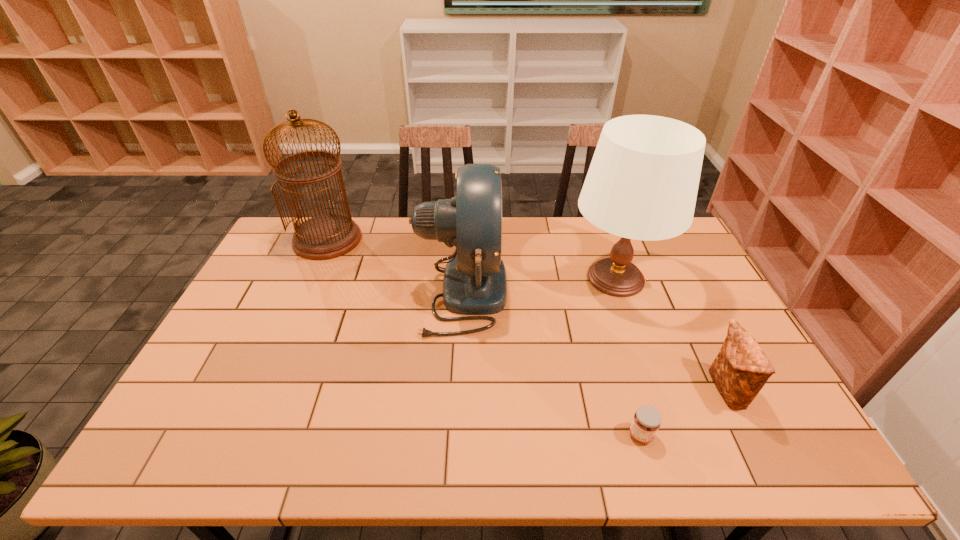
Find the location of a particular element. The height and width of the screenshot is (540, 960). lamp that is at the right edge is located at coordinates pos(642,183).

This screenshot has width=960, height=540. Find the location of `clutch bag at the right edge`. clutch bag at the right edge is located at coordinates (741, 369).

I want to click on object situated at the far left corner, so click(327, 236).

Identify the location of object that is at the far right corner. (642, 183).

Identify the location of vacant space at the far edge of the desktop. Image resolution: width=960 pixels, height=540 pixels. (508, 238).

Locate an element on the screen. This screenshot has height=540, width=960. free space at the near edge of the desktop is located at coordinates (601, 435).

This screenshot has height=540, width=960. In the image, there is a desktop. What are the coordinates of `vacant space at the left edge` in the screenshot? It's located at (256, 277).

What are the coordinates of `vacant space at the right edge` in the screenshot? It's located at (715, 291).

The image size is (960, 540). I want to click on vacant space at the near right corner of the desktop, so click(802, 441).

This screenshot has height=540, width=960. Identify the location of free area in between the second shortest object and the nearest object. (684, 413).